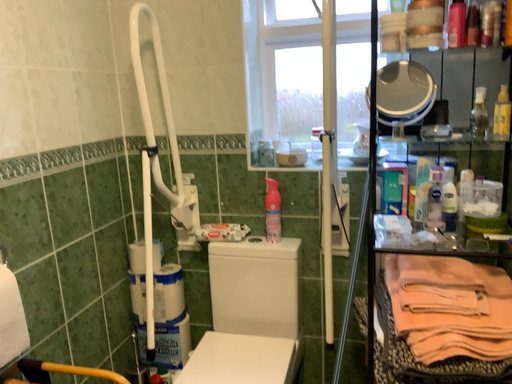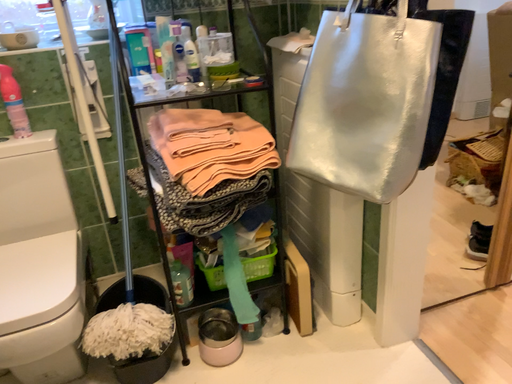
Question: How did the camera likely rotate when shooting the video?

Choices:
 (A) rotated right
 (B) rotated left

Answer: (A)